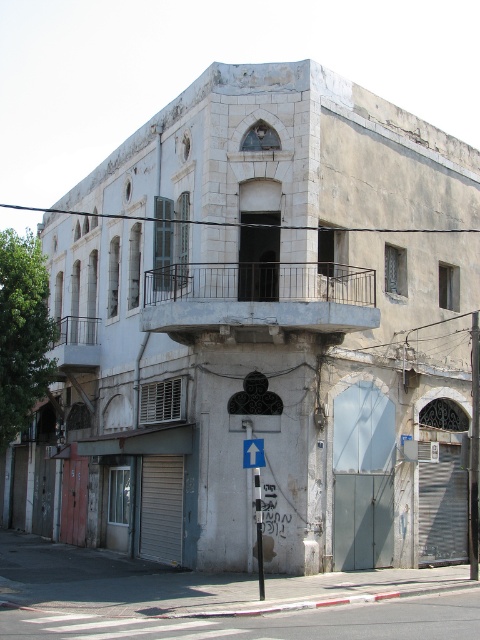
You are standing in front of the old weathered building. You need to locate the white metal balcony at center. Where is it positioned in terms of horizontal and vertical coordinates on the image?

The white metal balcony at center is positioned at the coordinates 0.466 on the horizontal axis and 0.540 on the vertical axis.

You are standing in front of the old building and want to take a photo. You notice two points marked on the building. The first point is at coordinate point (188, 275) and the second is at point (263, 465). Which point is closer to your camera lens?

Point (263, 465) is closer to the camera lens because it is positioned nearer than point (188, 275), which is further away from the camera.